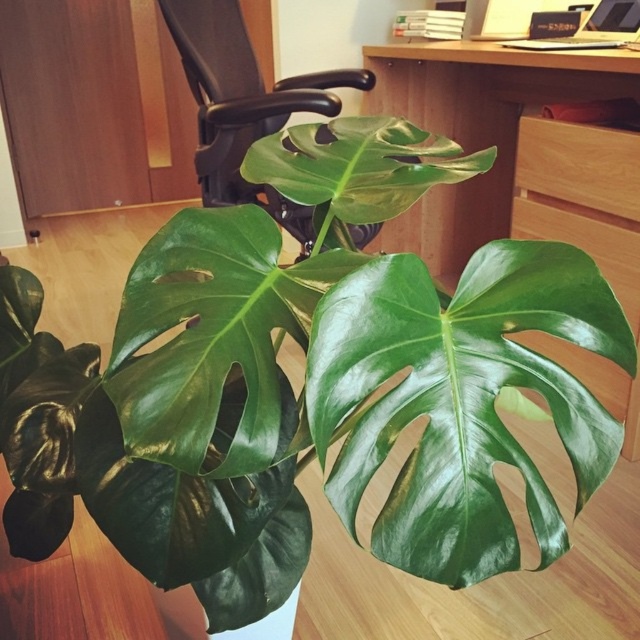
You are organizing a small workspace and want to place a new potted plant between the black leather swivel chair at center and the wooden drawer at right. Given that the plant requires at least 1 meter of space to grow, can you determine if there is enough space between these two objects?

The black leather swivel chair at center is bigger than the wooden drawer at right, but the exact distance between them isn

You are organizing a small plant exhibition and need to place the green glossy leaf at center and the black leather swivel chair at center on a table. The table has a width of 1 meter. Can both items fit side by side on the table without overlapping?

The green glossy leaf at center has a width less than the black leather swivel chair at center. Since the total width of both items combined is less than 1 meter, they can fit side by side on the table without overlapping.

You are organizing a desk and see the green shiny leaf at center and the wooden at center. Which object is located to the left of the other?

The green shiny leaf at center is positioned on the left side of wooden at center.